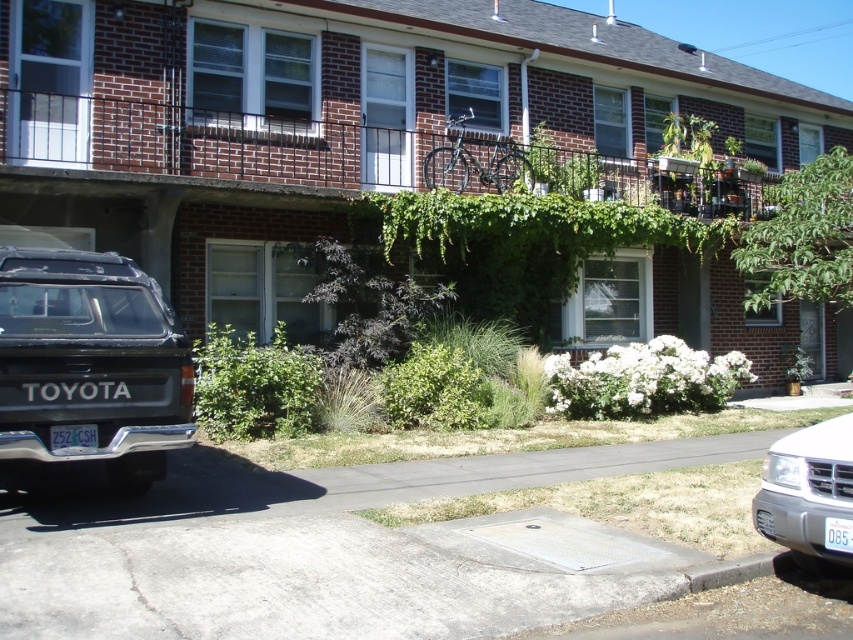
Question: Is matte black suv at lower left thinner than white plastic license plate at lower left?

Choices:
 (A) no
 (B) yes

Answer: (A)

Question: Based on their relative distances, which object is farther from the white plastic license plate at lower right?

Choices:
 (A) white matte suv at lower right
 (B) matte black suv at lower left
 (C) white plastic license plate at lower left

Answer: (C)

Question: Is white matte suv at lower right above white plastic license plate at lower right?

Choices:
 (A) yes
 (B) no

Answer: (A)

Question: Among these points, which one is farthest from the camera?

Choices:
 (A) (96, 429)
 (B) (828, 540)

Answer: (A)

Question: Considering the real-world distances, which object is farthest from the white matte suv at lower right?

Choices:
 (A) matte black suv at lower left
 (B) white plastic license plate at lower right
 (C) white plastic license plate at lower left

Answer: (C)

Question: Is white plastic license plate at lower left to the right of white plastic license plate at lower right from the viewer's perspective?

Choices:
 (A) no
 (B) yes

Answer: (A)